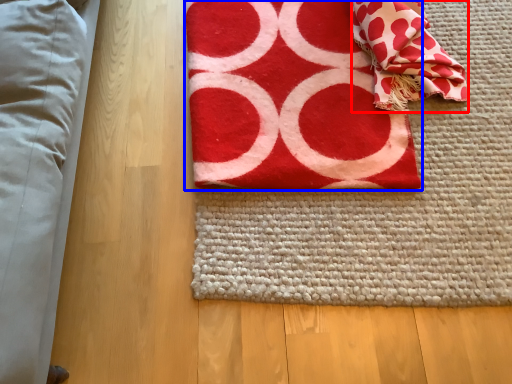
Question: Which point is further to the camera, blanket (highlighted by a red box) or towel (highlighted by a blue box)?

Choices:
 (A) blanket
 (B) towel

Answer: (A)